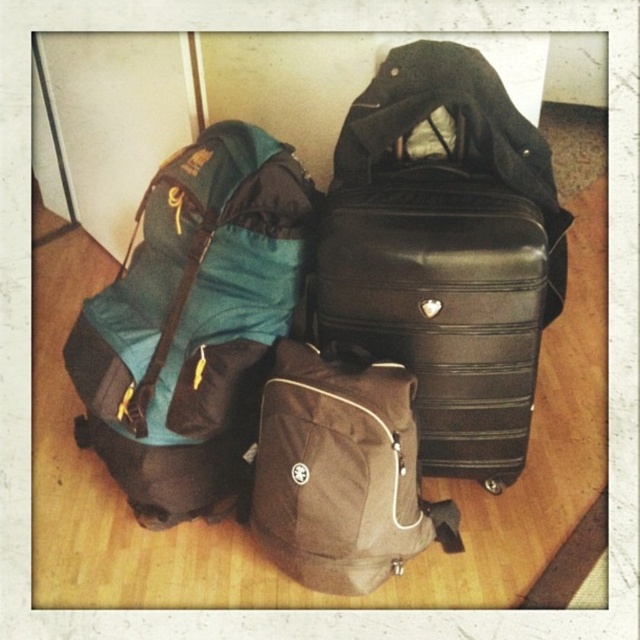
Question: Where is teal fabric backpack at left located in relation to brown fabric backpack at center in the image?

Choices:
 (A) below
 (B) above

Answer: (B)

Question: Which point is closer to the camera?

Choices:
 (A) (401, 355)
 (B) (209, 376)
 (C) (308, 508)

Answer: (C)

Question: Which point is farther to the camera?

Choices:
 (A) (124, 397)
 (B) (392, 550)

Answer: (A)

Question: Is teal fabric backpack at left positioned before black hardshell suitcase at center?

Choices:
 (A) no
 (B) yes

Answer: (A)

Question: Does teal fabric backpack at left have a smaller size compared to black hardshell suitcase at center?

Choices:
 (A) no
 (B) yes

Answer: (A)

Question: Which object is positioned farthest from the teal fabric backpack at left?

Choices:
 (A) brown fabric backpack at center
 (B) black hardshell suitcase at center

Answer: (B)